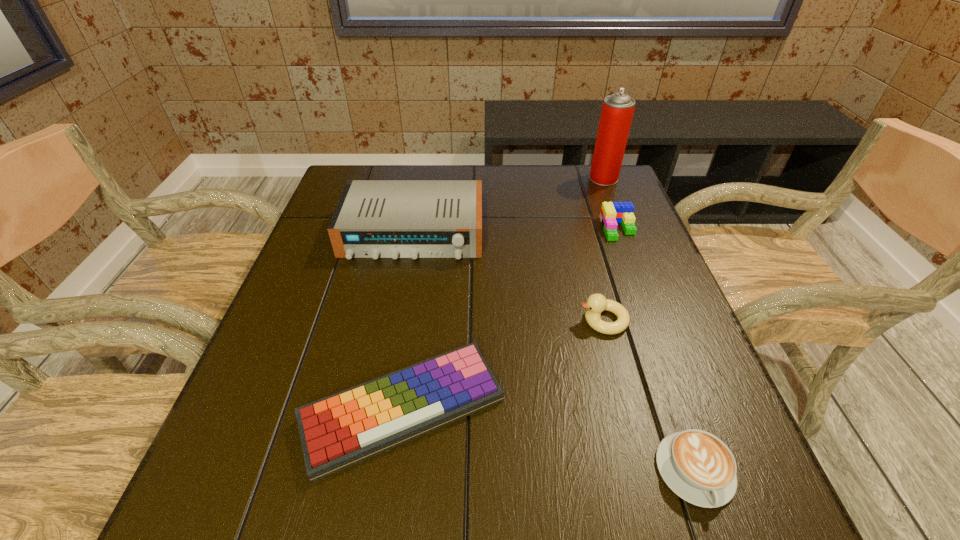
Locate an element on the screen. computer keyboard present at the left edge is located at coordinates (345, 428).

Where is `aerosol can present at the right edge`? The image size is (960, 540). aerosol can present at the right edge is located at coordinates (617, 111).

The height and width of the screenshot is (540, 960). Identify the location of duckling that is at the right edge. (596, 303).

You are a GUI agent. You are given a task and a screenshot of the screen. Output one action in this format:
    pyautogui.click(x=<x>, y=<y>)
    Task: Click on the Lego positioned at the right edge
    The image size is (960, 540).
    Given the screenshot: What is the action you would take?
    pyautogui.click(x=611, y=213)

At what (x,y) coordinates should I click in order to perform the action: click on cappuccino that is at the right edge. Please return your answer as a coordinate pair (x, y). Looking at the image, I should click on (697, 466).

What are the coordinates of `object at the far left corner` in the screenshot? It's located at (375, 219).

Locate an element on the screen. This screenshot has width=960, height=540. object that is at the near left corner is located at coordinates (345, 428).

Identify the location of object at the far right corner. The width and height of the screenshot is (960, 540). (617, 111).

What are the coordinates of `object that is at the near right corner` in the screenshot? It's located at (697, 466).

This screenshot has height=540, width=960. I want to click on free location at the far edge of the desktop, so click(433, 172).